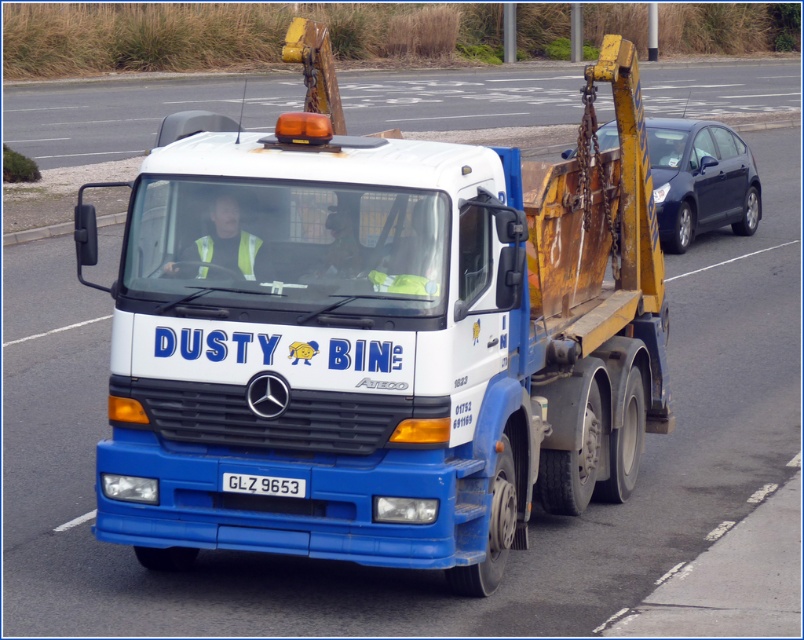
Question: Among these points, which one is nearest to the camera?

Choices:
 (A) (745, 67)
 (B) (302, 481)

Answer: (B)

Question: Is white glossy truck at center bigger than matte black car at right?

Choices:
 (A) no
 (B) yes

Answer: (B)

Question: Is blue matte tow truck at center bigger than white glossy truck at center?

Choices:
 (A) no
 (B) yes

Answer: (A)

Question: Which object appears farthest from the camera in this image?

Choices:
 (A) white glossy truck at center
 (B) matte black car at right
 (C) white plastic license plate at center
 (D) blue matte tow truck at center

Answer: (B)

Question: Which point appears closest to the camera in this image?

Choices:
 (A) (166, 209)
 (B) (249, 474)
 (C) (679, 212)

Answer: (B)

Question: In this image, where is white glossy truck at center located relative to matte black car at right?

Choices:
 (A) above
 (B) below

Answer: (A)